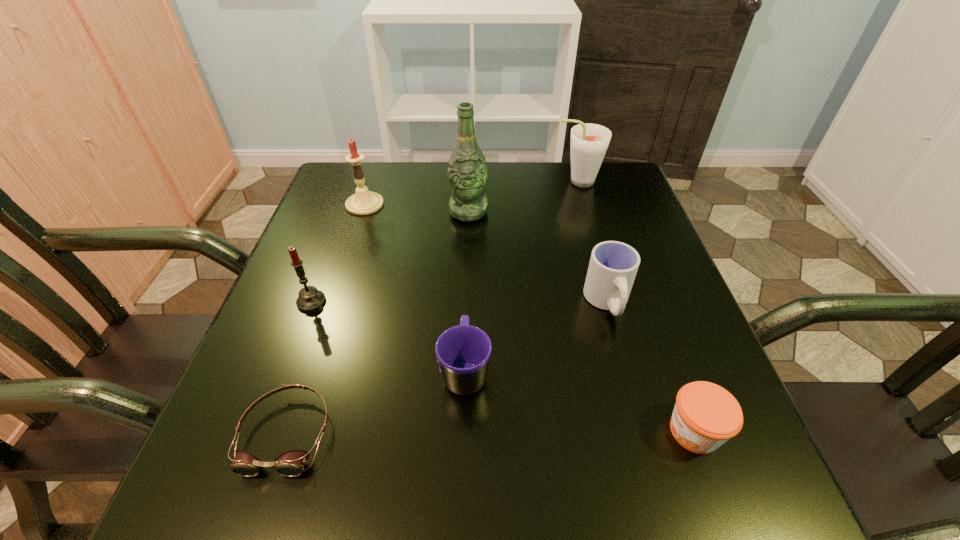
The width and height of the screenshot is (960, 540). What are the coordinates of `free space located on the front label of the second shortest object` in the screenshot? It's located at (451, 431).

You are a GUI agent. You are given a task and a screenshot of the screen. Output one action in this format:
    pyautogui.click(x=<x>, y=<y>)
    Task: Click on the free region located on the front label of the second shortest object
    
    Given the screenshot: What is the action you would take?
    pyautogui.click(x=413, y=431)

Find the location of a particular element. The height and width of the screenshot is (540, 960). vacant space positioned 0.050m through the lenses of the goggles is located at coordinates (259, 517).

Find the location of `beer bottle present at the far edge`. beer bottle present at the far edge is located at coordinates (467, 174).

The height and width of the screenshot is (540, 960). Identify the location of root beer at the far edge. (589, 142).

The height and width of the screenshot is (540, 960). Identify the location of candle situated at the far edge. (364, 202).

I want to click on jam situated at the near edge, so click(705, 416).

Where is `goggles present at the near edge`? goggles present at the near edge is located at coordinates (291, 463).

Where is `goggles present at the left edge`? This screenshot has width=960, height=540. goggles present at the left edge is located at coordinates (291, 463).

What are the coordinates of `root beer at the right edge` in the screenshot? It's located at (589, 142).